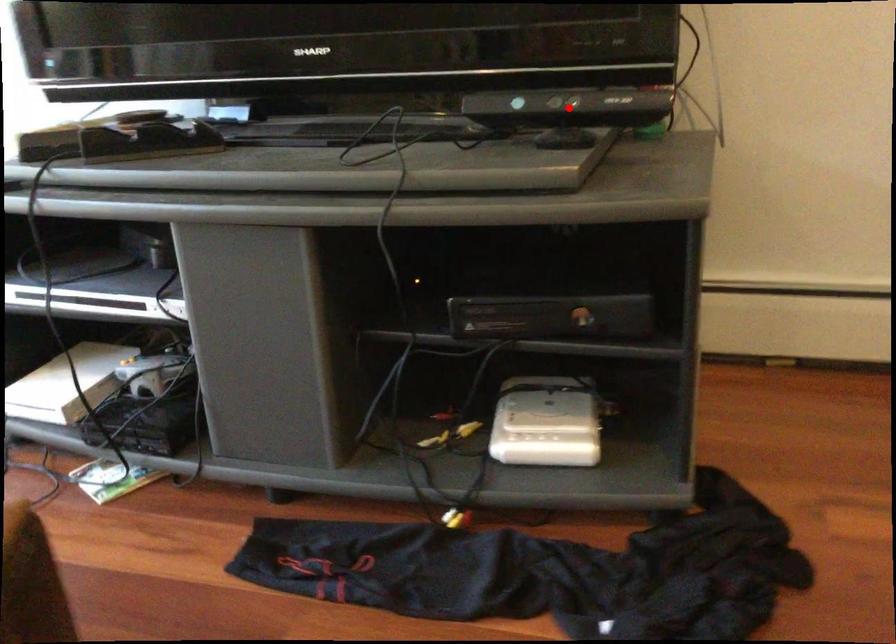
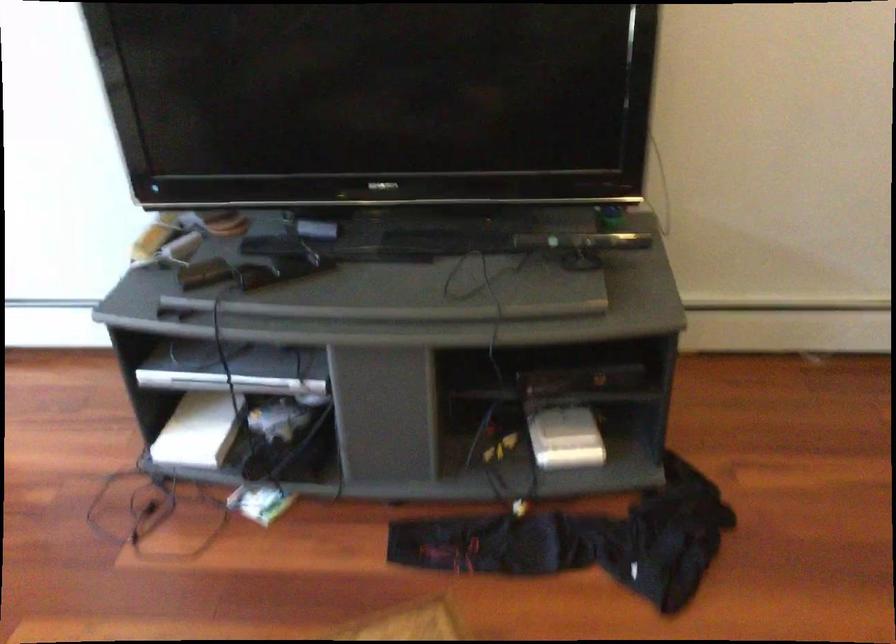
Question: I am providing you with two images of the same scene from different viewpoints. A red point is shown in image1. For the corresponding object point in image2, is it positioned nearer or farther from the camera?

Choices:
 (A) Nearer
 (B) Farther

Answer: (B)